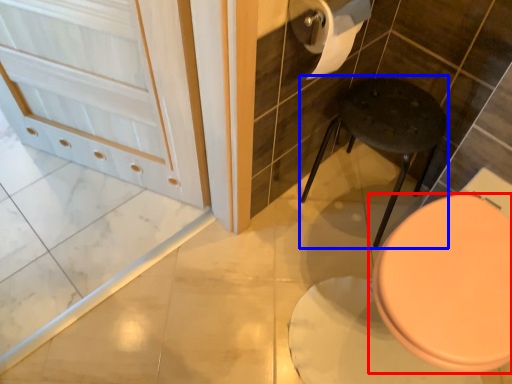
Question: Which object appears closest to the camera in this image, toilet (highlighted by a red box) or bar stool (highlighted by a blue box)?

Choices:
 (A) toilet
 (B) bar stool

Answer: (A)